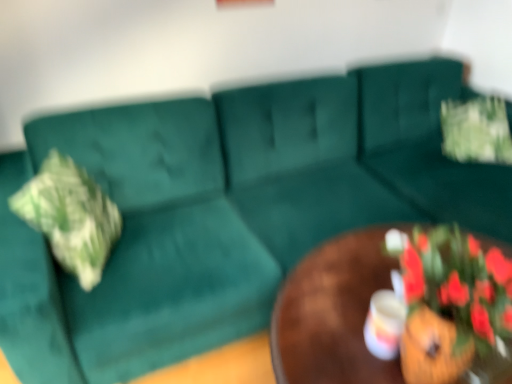
Question: In terms of size, does green textured pillow at left appear bigger or smaller than green fabric flower at upper right?

Choices:
 (A) big
 (B) small

Answer: (A)

Question: Considering the relative positions of green textured pillow at left and green fabric flower at upper right in the image provided, is green textured pillow at left to the left or to the right of green fabric flower at upper right?

Choices:
 (A) left
 (B) right

Answer: (A)

Question: Which object is the closest to the green fabric flower at upper right?

Choices:
 (A) matte white coffee cup at center
 (B) brown wooden table at center
 (C) green textured pillow at left

Answer: (B)

Question: Estimate the real-world distances between objects in this image. Which object is farther from the green textured pillow at left?

Choices:
 (A) matte white coffee cup at center
 (B) brown wooden table at center
 (C) green fabric flower at upper right

Answer: (C)